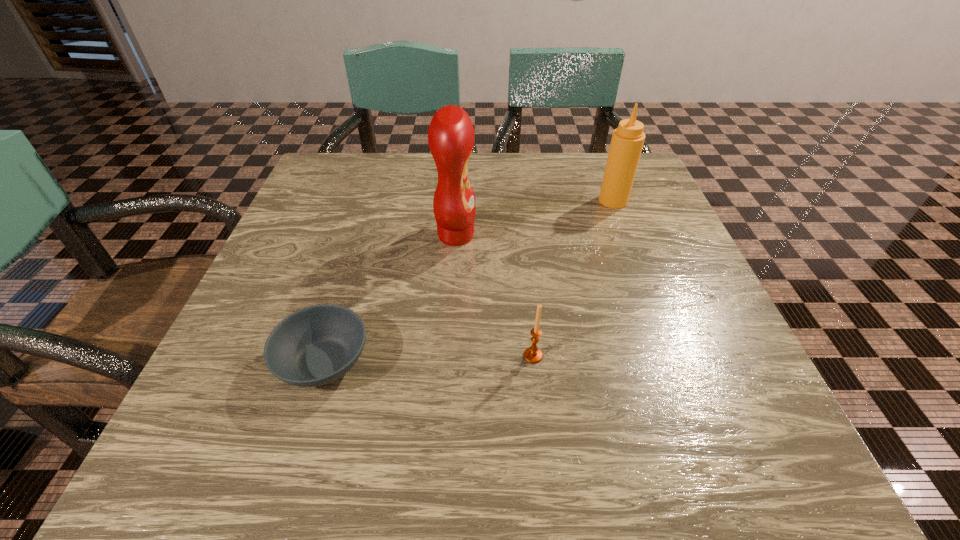
Find the location of `the left condiment`. the left condiment is located at coordinates (451, 137).

I want to click on the third nearest object, so (x=451, y=137).

Locate an element on the screen. the farther condiment is located at coordinates (627, 141).

Find the location of a particular element. This screenshot has height=540, width=960. the rightmost object is located at coordinates (627, 141).

Identify the location of the third tallest object. The height and width of the screenshot is (540, 960). (533, 355).

Where is `the second object from right to left`? The image size is (960, 540). the second object from right to left is located at coordinates (533, 355).

In order to click on the shortest object in this screenshot , I will do `click(314, 346)`.

Locate an element on the screen. The width and height of the screenshot is (960, 540). the leftmost object is located at coordinates (314, 346).

You are a GUI agent. You are given a task and a screenshot of the screen. Output one action in this format:
    pyautogui.click(x=<x>, y=<y>)
    Task: Click on the free space located on the label side of the third nearest object
    This screenshot has height=540, width=960.
    Given the screenshot: What is the action you would take?
    pyautogui.click(x=649, y=235)

Find the location of `free space located 0.150m on the back of the rightmost object`. free space located 0.150m on the back of the rightmost object is located at coordinates (598, 160).